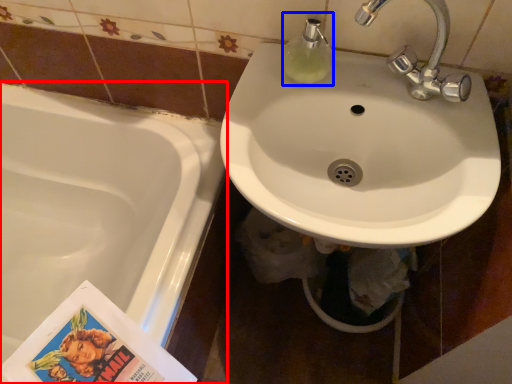
Question: Which of the following is the closest to the observer, bathtub (highlighted by a red box) or soap dispenser (highlighted by a blue box)?

Choices:
 (A) bathtub
 (B) soap dispenser

Answer: (B)